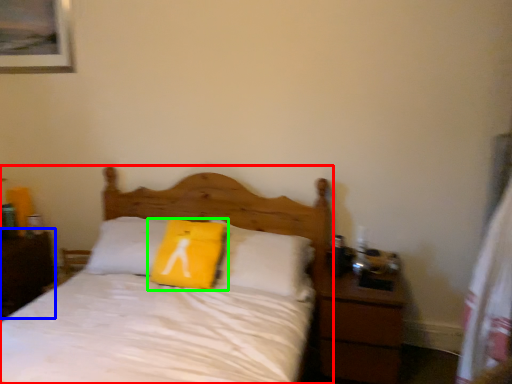
Question: Which object is the farthest from bed (highlighted by a red box)? Choose among these: nightstand (highlighted by a blue box) or pillow (highlighted by a green box).

Choices:
 (A) nightstand
 (B) pillow

Answer: (A)